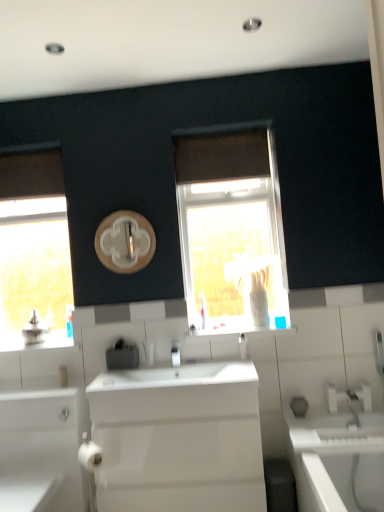
Question: From the image's perspective, is white glossy cabinet at lower left located beneath wooden circle at center?

Choices:
 (A) yes
 (B) no

Answer: (A)

Question: From a real-world perspective, is white glossy cabinet at lower left on top of wooden circle at center?

Choices:
 (A) yes
 (B) no

Answer: (B)

Question: Is white glossy cabinet at lower left wider than wooden circle at center?

Choices:
 (A) yes
 (B) no

Answer: (A)

Question: Does white glossy cabinet at lower left lie in front of wooden circle at center?

Choices:
 (A) no
 (B) yes

Answer: (B)

Question: Is white glossy cabinet at lower left positioned behind wooden circle at center?

Choices:
 (A) yes
 (B) no

Answer: (B)

Question: Can you confirm if white glossy cabinet at lower left is positioned to the left of wooden circle at center?

Choices:
 (A) yes
 (B) no

Answer: (A)

Question: From the image's perspective, is silver metallic tap at center on white glossy cabinet at lower left?

Choices:
 (A) no
 (B) yes

Answer: (B)

Question: Can you confirm if silver metallic tap at center is positioned to the left of white glossy cabinet at lower left?

Choices:
 (A) yes
 (B) no

Answer: (B)

Question: Is silver metallic tap at center to the right of white glossy cabinet at lower left from the viewer's perspective?

Choices:
 (A) no
 (B) yes

Answer: (B)

Question: Can you confirm if silver metallic tap at center is shorter than white glossy cabinet at lower left?

Choices:
 (A) yes
 (B) no

Answer: (A)

Question: Could you tell me if silver metallic tap at center is turned towards white glossy cabinet at lower left?

Choices:
 (A) no
 (B) yes

Answer: (A)

Question: Is the position of silver metallic tap at center more distant than that of white glossy cabinet at lower left?

Choices:
 (A) yes
 (B) no

Answer: (A)

Question: Are white glossy window sill at center and white glossy bathtub at lower right making contact?

Choices:
 (A) yes
 (B) no

Answer: (B)